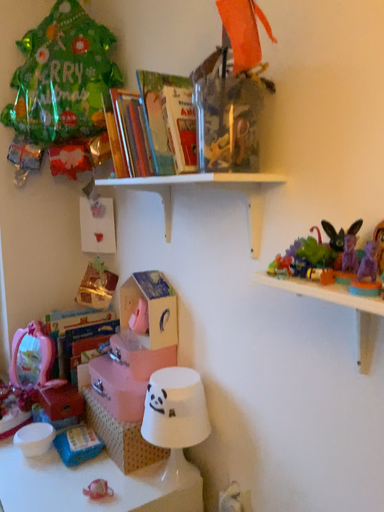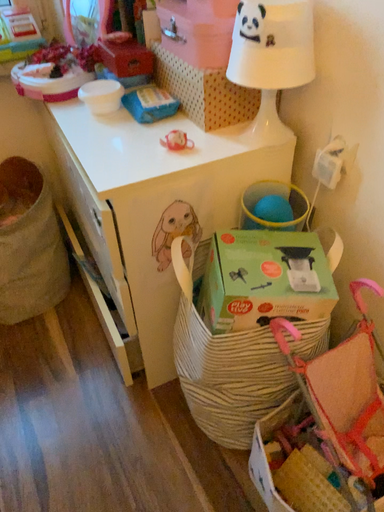
Question: How did the camera likely rotate when shooting the video?

Choices:
 (A) rotated upward
 (B) rotated downward

Answer: (B)